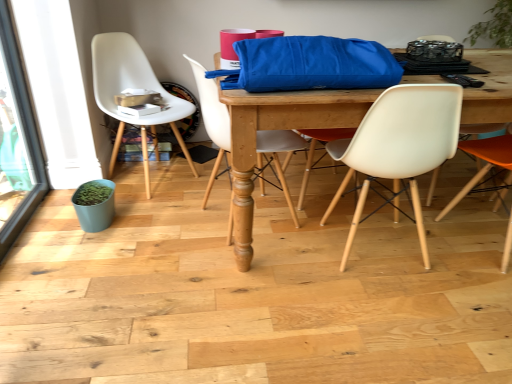
Locate an element on the screen. This screenshot has height=384, width=512. white plastic chair at center, which ranks as the third chair in left-to-right order is located at coordinates (400, 145).

Locate an element on the screen. orange matte chair at right, the 4th chair viewed from the left is located at coordinates click(484, 166).

What are the coordinates of `blue fabric bag at center` in the screenshot? It's located at (279, 129).

Describe the element at coordinates (212, 119) in the screenshot. Image resolution: width=512 pixels, height=384 pixels. I see `matte white chair at center, positioned as the 2th chair in left-to-right order` at that location.

The width and height of the screenshot is (512, 384). Describe the element at coordinates (17, 141) in the screenshot. I see `transparent glass screen door at left` at that location.

This screenshot has height=384, width=512. Find the location of `matte blue flowerpot at lower left`. matte blue flowerpot at lower left is located at coordinates (95, 205).

You are a GUI agent. You are given a task and a screenshot of the screen. Output one action in this format:
    pyautogui.click(x=<x>, y=<y>)
    Task: Click on the white plastic chair at left, positioned as the first chair in left-to-right order
    The height and width of the screenshot is (384, 512).
    Given the screenshot: What is the action you would take?
    point(128,89)

In the scene shown: Which object is closer to the camera, matte blue flowerpot at lower left or white plastic chair at left, the 4th chair when ordered from right to left?

Positioned in front is white plastic chair at left, the 4th chair when ordered from right to left.

Can we say matte blue flowerpot at lower left lies outside white plastic chair at left, positioned as the first chair in left-to-right order?

That's correct, matte blue flowerpot at lower left is outside of white plastic chair at left, positioned as the first chair in left-to-right order.

How different are the orientations of matte blue flowerpot at lower left and white plastic chair at left, the 4th chair when ordered from right to left, in degrees?

42.6 degrees separate the facing orientations of matte blue flowerpot at lower left and white plastic chair at left, the 4th chair when ordered from right to left.

Measure the distance between matte blue flowerpot at lower left and white plastic chair at left, the 4th chair when ordered from right to left.

A distance of 21.46 inches exists between matte blue flowerpot at lower left and white plastic chair at left, the 4th chair when ordered from right to left.

This screenshot has width=512, height=384. In order to click on desk beneath the matte white chair at center, which is counted as the 3th chair, starting from the right (from a real-world perspective) in this screenshot , I will do `click(279, 129)`.

Is matte white chair at center, positioned as the 2th chair in left-to-right order, at the back of blue fabric bag at center?

No, matte white chair at center, positioned as the 2th chair in left-to-right order, is not at the back of blue fabric bag at center.

From a real-world perspective, which is physically above, blue fabric bag at center or matte white chair at center, which is counted as the 3th chair, starting from the right?

From a 3D spatial view, matte white chair at center, which is counted as the 3th chair, starting from the right, is above.

Who is taller, blue fabric bag at center or matte white chair at center, which is counted as the 3th chair, starting from the right?

matte white chair at center, which is counted as the 3th chair, starting from the right, is taller.

Considering the sizes of white plastic chair at center, which ranks as the third chair in left-to-right order, and white plastic chair at left, positioned as the first chair in left-to-right order, in the image, is white plastic chair at center, which ranks as the third chair in left-to-right order, bigger or smaller than white plastic chair at left, positioned as the first chair in left-to-right order,?

Clearly, white plastic chair at center, which ranks as the third chair in left-to-right order, is smaller in size than white plastic chair at left, positioned as the first chair in left-to-right order.

How distant is white plastic chair at center, which ranks as the third chair in left-to-right order, from white plastic chair at left, the 4th chair when ordered from right to left?

1.26 meters.

Who is taller, white plastic chair at center, placed as the 2th chair when sorted from right to left, or white plastic chair at left, the 4th chair when ordered from right to left?

white plastic chair at left, the 4th chair when ordered from right to left.

Does white plastic chair at left, the 4th chair when ordered from right to left, have a greater width compared to blue fabric bag at center?

No.

Does white plastic chair at left, the 4th chair when ordered from right to left, touch blue fabric bag at center?

There is a gap between white plastic chair at left, the 4th chair when ordered from right to left, and blue fabric bag at center.

Does white plastic chair at left, positioned as the first chair in left-to-right order, turn towards blue fabric bag at center?

Yes.

Does white plastic chair at left, the 4th chair when ordered from right to left, appear on the left side of blue fabric bag at center?

Correct, you'll find white plastic chair at left, the 4th chair when ordered from right to left, to the left of blue fabric bag at center.

Which object is closer to the camera, transparent glass screen door at left or blue fabric bag at center?

transparent glass screen door at left.

Is transparent glass screen door at left directly adjacent to blue fabric bag at center?

No.

Is transparent glass screen door at left at the left side of blue fabric bag at center?

Yes, transparent glass screen door at left is to the left of blue fabric bag at center.

Which of these two, transparent glass screen door at left or blue fabric bag at center, is bigger?

With larger size is blue fabric bag at center.

Is black plastic remote control at upper right to the right of matte white chair at center, positioned as the 2th chair in left-to-right order, from the viewer's perspective?

Indeed, black plastic remote control at upper right is positioned on the right side of matte white chair at center, positioned as the 2th chair in left-to-right order.

Identify the location of the 2nd chair directly beneath the black plastic remote control at upper right (from a real-world perspective). (212, 119).

Which of these two, black plastic remote control at upper right or matte white chair at center, positioned as the 2th chair in left-to-right order, is wider?

matte white chair at center, positioned as the 2th chair in left-to-right order, is wider.

Does black plastic remote control at upper right turn towards matte white chair at center, positioned as the 2th chair in left-to-right order?

No.

Is black plastic remote control at upper right at the left side of white plastic chair at left, the 4th chair when ordered from right to left?

In fact, black plastic remote control at upper right is to the right of white plastic chair at left, the 4th chair when ordered from right to left.

Which is closer to the camera, (482, 81) or (145, 159)?

Point (482, 81) is closer to the camera than point (145, 159).

Is black plastic remote control at upper right not close to white plastic chair at left, the 4th chair when ordered from right to left?

black plastic remote control at upper right is positioned a significant distance from white plastic chair at left, the 4th chair when ordered from right to left.

From the image's perspective, starting from the matte blue flowerpot at lower left, which chair is the 4th one above? Please provide its 2D coordinates.

[(128, 89)]

Locate an element on the screen. Image resolution: width=512 pixels, height=384 pixels. chair that is the 2nd one when counting leftward from the blue fabric bag at center is located at coordinates (212, 119).

Looking at the image, which one is located closer to white plastic chair at center, which ranks as the third chair in left-to-right order, matte white chair at center, which is counted as the 3th chair, starting from the right, or black plastic remote control at upper right?

Among the two, black plastic remote control at upper right is located nearer to white plastic chair at center, which ranks as the third chair in left-to-right order.

Estimate the real-world distances between objects in this image. Which object is closer to white plastic chair at left, positioned as the first chair in left-to-right order, matte blue flowerpot at lower left or transparent glass screen door at left?

The object closer to white plastic chair at left, positioned as the first chair in left-to-right order, is transparent glass screen door at left.

Based on their spatial positions, is white plastic chair at center, which ranks as the third chair in left-to-right order, or black plastic remote control at upper right closer to matte white chair at center, positioned as the 2th chair in left-to-right order?

white plastic chair at center, which ranks as the third chair in left-to-right order, is positioned closer to the anchor matte white chair at center, positioned as the 2th chair in left-to-right order.

Based on their spatial positions, is matte blue flowerpot at lower left or transparent glass screen door at left closer to blue fabric bag at center?

Among the two, matte blue flowerpot at lower left is located nearer to blue fabric bag at center.

Considering their positions, is orange matte chair at right, which is the 1th chair from right to left, positioned further to matte white chair at center, positioned as the 2th chair in left-to-right order, than matte blue flowerpot at lower left?

Among the two, orange matte chair at right, which is the 1th chair from right to left, is located further to matte white chair at center, positioned as the 2th chair in left-to-right order.

Estimate the real-world distances between objects in this image. Which object is closer to blue fabric bag at center, matte white chair at center, positioned as the 2th chair in left-to-right order, or matte blue flowerpot at lower left?

Based on the image, matte white chair at center, positioned as the 2th chair in left-to-right order, appears to be nearer to blue fabric bag at center.

Looking at the image, which one is located further to blue fabric bag at center, matte blue flowerpot at lower left or matte white chair at center, positioned as the 2th chair in left-to-right order?

Based on the image, matte blue flowerpot at lower left appears to be further to blue fabric bag at center.

Looking at the image, which one is located further to matte white chair at center, positioned as the 2th chair in left-to-right order, orange matte chair at right, the 4th chair viewed from the left, or blue fabric bag at center?

orange matte chair at right, the 4th chair viewed from the left, lies further to matte white chair at center, positioned as the 2th chair in left-to-right order, than the other object.

The height and width of the screenshot is (384, 512). What are the coordinates of `flowerpot situated between transparent glass screen door at left and black plastic remote control at upper right from left to right` in the screenshot? It's located at (95, 205).

At what (x,y) coordinates should I click in order to perform the action: click on remote control between matte white chair at center, which is counted as the 3th chair, starting from the right, and orange matte chair at right, the 4th chair viewed from the left, in the horizontal direction. Please return your answer as a coordinate pair (x, y). The height and width of the screenshot is (384, 512). Looking at the image, I should click on (462, 80).

You are a GUI agent. You are given a task and a screenshot of the screen. Output one action in this format:
    pyautogui.click(x=<x>, y=<y>)
    Task: Click on the flowerpot situated between transparent glass screen door at left and white plastic chair at center, which ranks as the third chair in left-to-right order, from left to right
    This screenshot has height=384, width=512.
    Given the screenshot: What is the action you would take?
    pyautogui.click(x=95, y=205)

Where is `desk between matte blue flowerpot at lower left and orange matte chair at right, the 4th chair viewed from the left, from left to right`? This screenshot has width=512, height=384. desk between matte blue flowerpot at lower left and orange matte chair at right, the 4th chair viewed from the left, from left to right is located at coordinates (279, 129).